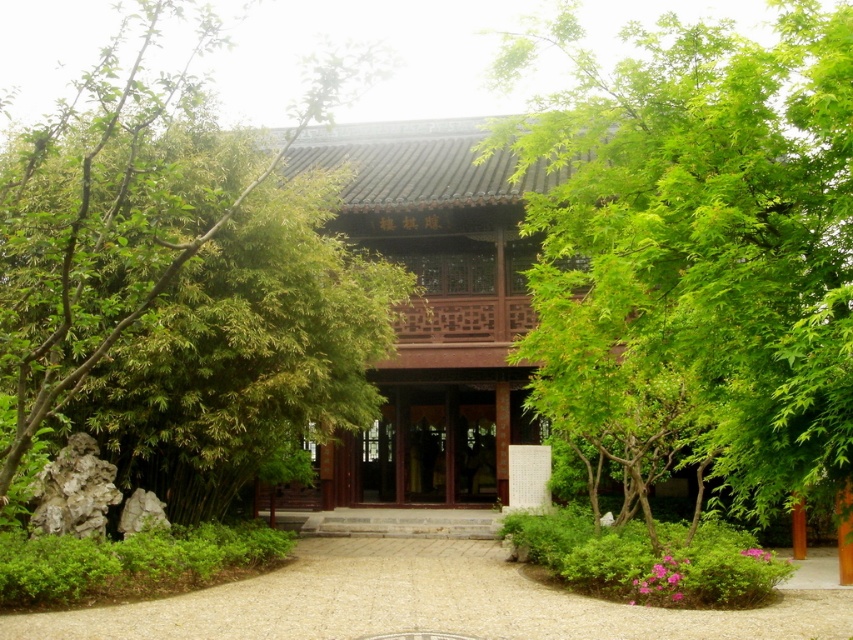
Between point (334, 371) and point (460, 474), which one is positioned behind?

Positioned behind is point (460, 474).

Which is more to the left, green bamboo at left or brown wooden door at center?

Positioned to the left is green bamboo at left.

The width and height of the screenshot is (853, 640). What do you see at coordinates (178, 285) in the screenshot?
I see `green bamboo at left` at bounding box center [178, 285].

In order to click on green bamboo at left in this screenshot , I will do `click(178, 285)`.

Is green leafy tree at center to the left of smooth gravel path at center from the viewer's perspective?

In fact, green leafy tree at center is to the right of smooth gravel path at center.

Is green leafy tree at center above smooth gravel path at center?

Indeed, green leafy tree at center is positioned over smooth gravel path at center.

Is point (660, 120) farther from camera compared to point (555, 616)?

No, (660, 120) is closer to viewer.

Identify the location of green leafy tree at center. The image size is (853, 640). (711, 230).

Does smooth gravel path at center have a greater width compared to green leafy bush at lower center?

Indeed, smooth gravel path at center has a greater width compared to green leafy bush at lower center.

Looking at this image, is smooth gravel path at center positioned at the back of green leafy bush at lower center?

No, it is not.

Which is behind, point (555, 588) or point (555, 540)?

Point (555, 540)

Locate an element on the screen. The image size is (853, 640). smooth gravel path at center is located at coordinates (434, 602).